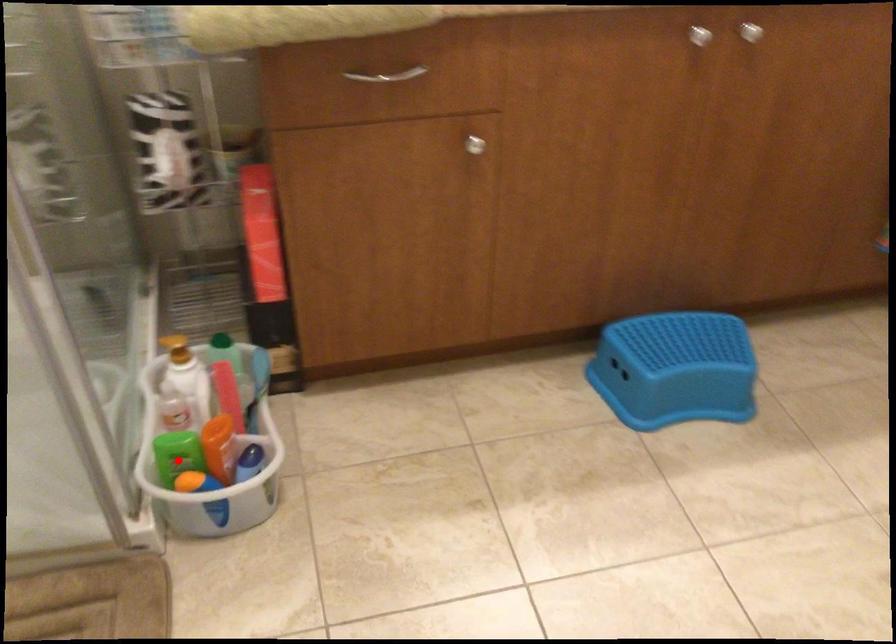
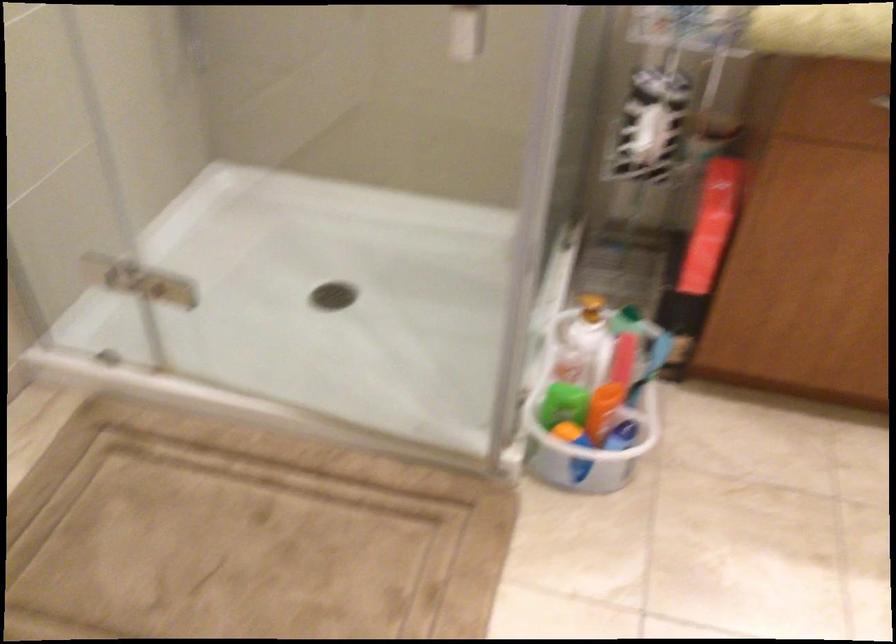
Locate, in the second image, the point that corresponds to the highlighted location in the first image.

(563, 402)